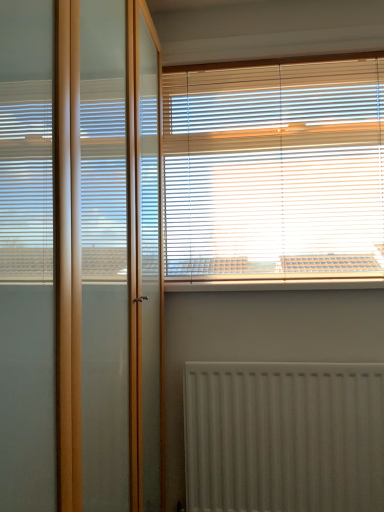
Question: Relative to transparent glass screen door at left, is white plastic window sill at upper center in front or behind?

Choices:
 (A) front
 (B) behind

Answer: (B)

Question: From the image's perspective, relative to transparent glass screen door at left, is white plastic window sill at upper center above or below?

Choices:
 (A) below
 (B) above

Answer: (A)

Question: Which is nearer to the wooden blinds at upper center?

Choices:
 (A) white textured radiator at lower center
 (B) transparent glass screen door at left
 (C) white plastic window sill at upper center

Answer: (C)

Question: Estimate the real-world distances between objects in this image. Which object is farther from the wooden blinds at upper center?

Choices:
 (A) white textured radiator at lower center
 (B) white plastic window sill at upper center
 (C) transparent glass screen door at left

Answer: (C)